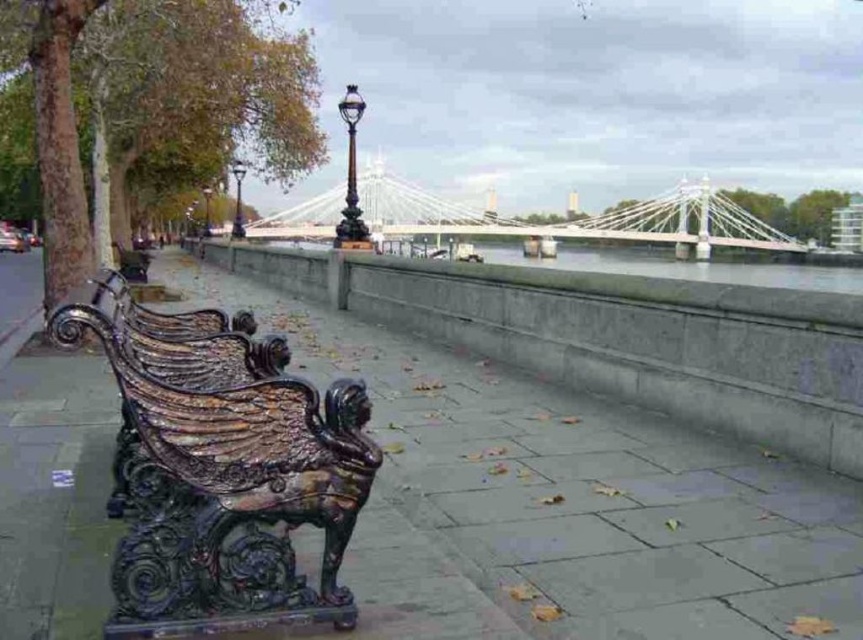
Question: Does polished dark bronze bench at left come behind white wire bridge at center?

Choices:
 (A) yes
 (B) no

Answer: (B)

Question: Does polished dark bronze bench at left have a lesser width compared to white wire bridge at center?

Choices:
 (A) yes
 (B) no

Answer: (A)

Question: Which object is closer to the camera taking this photo?

Choices:
 (A) polished dark green bench at center
 (B) glossy metal bench at left
 (C) polished dark bronze bench at left
 (D) white wire bridge at center

Answer: (C)

Question: Among these objects, which one is nearest to the camera?

Choices:
 (A) glossy metal bench at left
 (B) polished dark green bench at center

Answer: (A)

Question: Is glossy metal bench at left smaller than polished dark green bench at center?

Choices:
 (A) yes
 (B) no

Answer: (A)

Question: Which object is farther from the camera taking this photo?

Choices:
 (A) white wire bridge at center
 (B) glossy metal bench at left
 (C) polished dark bronze bench at left
 (D) polished dark green bench at center

Answer: (D)